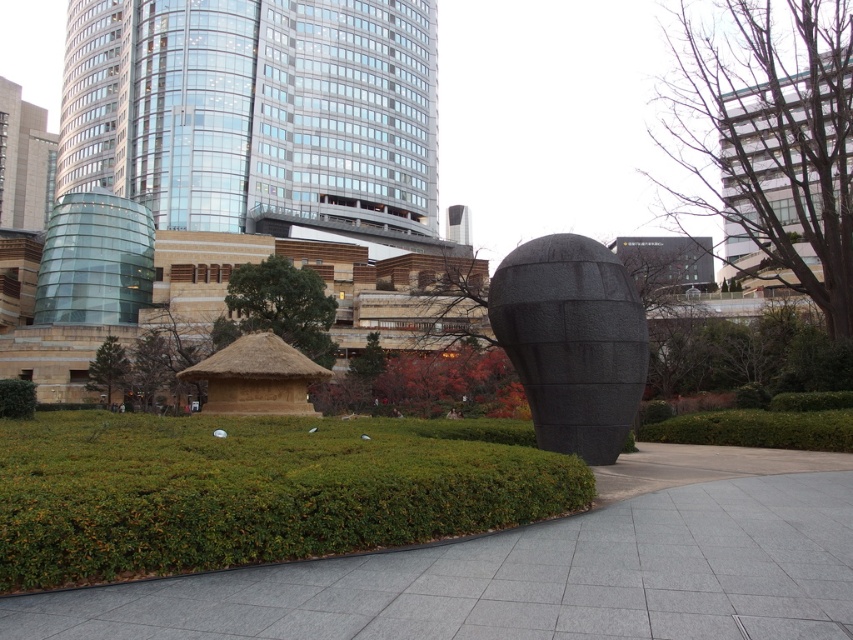
You are standing at the entrance of the park and want to reach the point marked as point [96,557]. However, you must first pass through point [9,416]. Is the point you want to reach located in front of or behind the point you must pass through?

Point [96,557] is in front of point [9,416], so the desired point is located in front of the point you must pass through.

You are standing at the entrance of the park and want to take a photo of both the green thatch hut at center and the green leafy hedge at lower left. Which object should you focus on first to ensure both are in frame?

The green thath hut at center is above the green leafy hedge at lower left, so you should focus on the green leafy hedge at lower left first to ensure both are in frame.